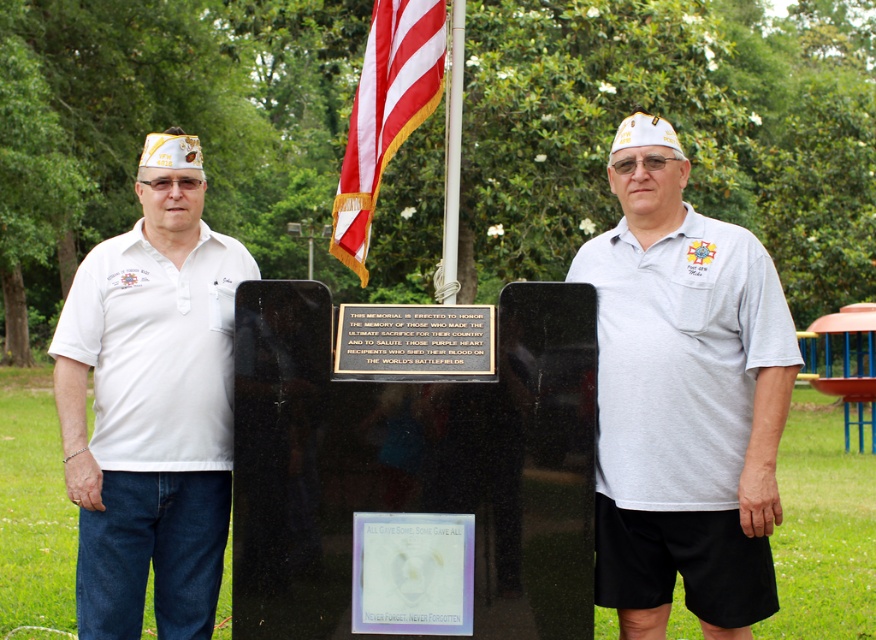
Is red/white striped fabric at upper center shorter than black polished stone plaque at center?

No.

Looking at this image, is red/white striped fabric at upper center further to camera compared to black polished stone plaque at center?

Yes, red/white striped fabric at upper center is further from the viewer.

Who is more forward, (396,76) or (422,305)?

Positioned in front is point (422,305).

At what (x,y) coordinates should I click in order to perform the action: click on red/white striped fabric at upper center. Please return your answer as a coordinate pair (x, y). Looking at the image, I should click on (385, 113).

How distant is gray cotton shirt at center from black polished stone plaque at center?

gray cotton shirt at center and black polished stone plaque at center are 26.83 inches apart from each other.

Locate an element on the screen. This screenshot has width=876, height=640. gray cotton shirt at center is located at coordinates (683, 397).

Locate an element on the screen. This screenshot has width=876, height=640. gray cotton shirt at center is located at coordinates (683, 397).

Can you confirm if gray cotton shirt at center is thinner than metallic flagpole at center?

Incorrect, gray cotton shirt at center's width is not less than metallic flagpole at center's.

Is gray cotton shirt at center to the right of metallic flagpole at center from the viewer's perspective?

Correct, you'll find gray cotton shirt at center to the right of metallic flagpole at center.

Who is more distant from viewer, (725, 234) or (460, 112)?

Positioned behind is point (460, 112).

Locate an element on the screen. gray cotton shirt at center is located at coordinates (683, 397).